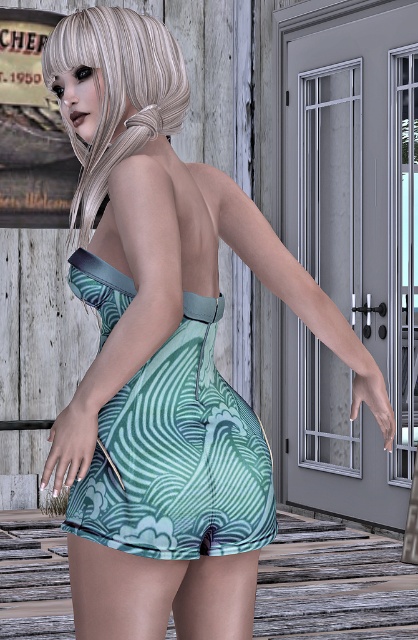
Which of these two, green printed fabric dress at center or blondehair at upper left, stands shorter?

blondehair at upper left is shorter.

Is green printed fabric dress at center smaller than blondehair at upper left?

Incorrect, green printed fabric dress at center is not smaller in size than blondehair at upper left.

Where is `green printed fabric dress at center`? green printed fabric dress at center is located at coordinates (178, 456).